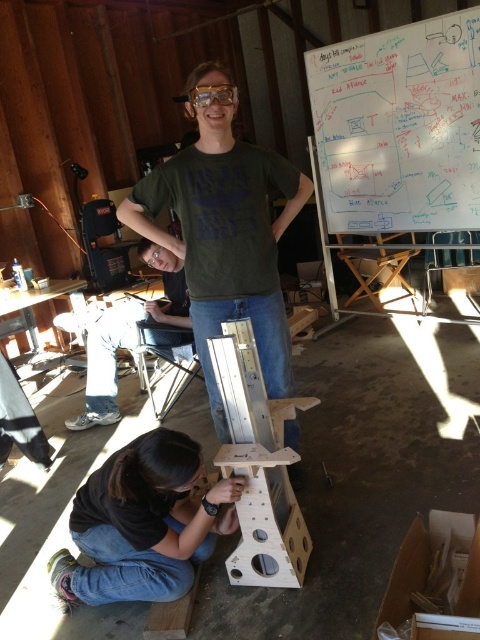
Can you confirm if whiteboard at upper right is positioned to the right of green matte t-shirt at center?

Yes, whiteboard at upper right is to the right of green matte t-shirt at center.

Is whiteboard at upper right further to camera compared to green matte t-shirt at center?

Yes, it is behind green matte t-shirt at center.

Which is behind, point (432, 180) or point (266, 308)?

The point (432, 180) is behind.

Find the location of a particular element. The width and height of the screenshot is (480, 640). whiteboard at upper right is located at coordinates (398, 128).

Can you confirm if black matte wood at lower center is taller than metallic silver easel at center?

In fact, black matte wood at lower center may be shorter than metallic silver easel at center.

Does black matte wood at lower center have a smaller size compared to metallic silver easel at center?

No, black matte wood at lower center is not smaller than metallic silver easel at center.

The image size is (480, 640). Identify the location of black matte wood at lower center. (143, 524).

This screenshot has width=480, height=640. In order to click on black matte wood at lower center in this screenshot , I will do `click(143, 524)`.

Between whiteboard at upper right and matte black shirt at center, which one appears on the left side from the viewer's perspective?

matte black shirt at center is more to the left.

Is point (312, 122) less distant than point (100, 371)?

No.

Image resolution: width=480 pixels, height=640 pixels. In order to click on whiteboard at upper right in this screenshot , I will do `click(398, 128)`.